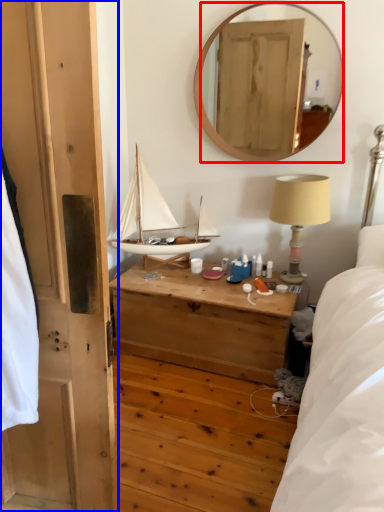
Question: Which of the following is the farthest to the observer, mirror (highlighted by a red box) or door (highlighted by a blue box)?

Choices:
 (A) mirror
 (B) door

Answer: (A)